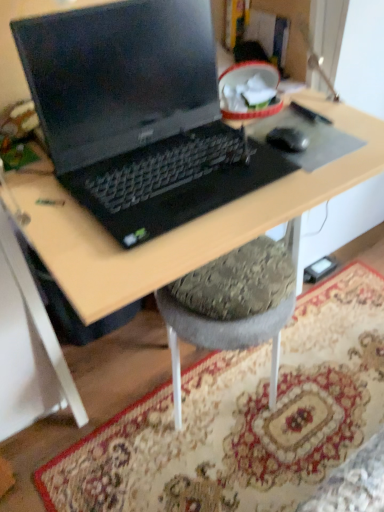
This screenshot has height=512, width=384. What do you see at coordinates (182, 226) in the screenshot?
I see `black plastic desk at center` at bounding box center [182, 226].

What do you see at coordinates (242, 419) in the screenshot?
I see `carpeted rug at lower center` at bounding box center [242, 419].

The image size is (384, 512). Identify the location of black rubber mouse at right. (287, 139).

In order to face black matte mousepad at center, should I rotate leftwards or rightwards?

Rotate right and turn 14.039 degrees.

Describe the element at coordinates (308, 138) in the screenshot. The width and height of the screenshot is (384, 512). I see `black matte mousepad at center` at that location.

Locate an element on the screen. Image resolution: width=384 pixels, height=512 pixels. black matte laptop at center is located at coordinates (139, 114).

Does black rubber mouse at right touch black matte laptop at center?

No, black rubber mouse at right is not with black matte laptop at center.

Based on the photo, from a real-world perspective, is black rubber mouse at right on black matte laptop at center?

No, from a real-world perspective, black rubber mouse at right is not above black matte laptop at center.

Is black rubber mouse at right looking in the opposite direction of black matte laptop at center?

No, black rubber mouse at right's orientation is not away from black matte laptop at center.

Who is smaller, black rubber mouse at right or black plastic desk at center?

With smaller size is black rubber mouse at right.

Is black rubber mouse at right oriented away from black plastic desk at center?

Yes, black rubber mouse at right's orientation is away from black plastic desk at center.

Considering the sizes of objects black rubber mouse at right and black plastic desk at center in the image provided, who is taller, black rubber mouse at right or black plastic desk at center?

With more height is black plastic desk at center.

Considering the relative positions of black rubber mouse at right and black plastic desk at center in the image provided, is black rubber mouse at right to the left or to the right of black plastic desk at center?

black rubber mouse at right is to the right of black plastic desk at center.

Which object is wider, carpeted rug at lower center or black matte laptop at center?

With larger width is carpeted rug at lower center.

Between carpeted rug at lower center and black matte laptop at center, which one has smaller size?

carpeted rug at lower center.

How many degrees apart are the facing directions of carpeted rug at lower center and black matte laptop at center?

They differ by 0.7 degrees in their facing directions.

Which is in front, carpeted rug at lower center or black matte laptop at center?

black matte laptop at center is in front.

Can you tell me how much black rubber mouse at right and carpeted rug at lower center differ in facing direction?

The angular difference between black rubber mouse at right and carpeted rug at lower center is 6.12 degrees.

Considering the positions of objects black rubber mouse at right and carpeted rug at lower center in the image provided, who is more to the right, black rubber mouse at right or carpeted rug at lower center?

From the viewer's perspective, carpeted rug at lower center appears more on the right side.

Identify the location of mat in front of the black rubber mouse at right. (242, 419).

Is the position of black rubber mouse at right more distant than that of carpeted rug at lower center?

Yes.

From a real-world perspective, is black plastic desk at center over black matte laptop at center?

Actually, black plastic desk at center is physically below black matte laptop at center in the real world.

In terms of width, does black plastic desk at center look wider or thinner when compared to black matte laptop at center?

Clearly, black plastic desk at center has more width compared to black matte laptop at center.

Consider the image. How different are the orientations of black plastic desk at center and black matte laptop at center in degrees?

0.7 degrees separate the facing orientations of black plastic desk at center and black matte laptop at center.

Considering the positions of objects black plastic desk at center and black matte laptop at center in the image provided, who is in front, black plastic desk at center or black matte laptop at center?

black plastic desk at center.

Which of these two, carpeted rug at lower center or black matte mousepad at center, is smaller?

With smaller size is black matte mousepad at center.

Find the location of a particular element. This screenshot has width=384, height=512. mousepad in front of the carpeted rug at lower center is located at coordinates (308, 138).

Considering the positions of point (133, 473) and point (320, 130), is point (133, 473) closer or farther from the camera than point (320, 130)?

Point (133, 473) is positioned farther from the camera compared to point (320, 130).

Consider the image. Would you consider carpeted rug at lower center to be distant from black matte mousepad at center?

No, carpeted rug at lower center is not far from black matte mousepad at center.

From the image's perspective, relative to black rubber mouse at right, is black plastic desk at center above or below?

From the image's perspective, black plastic desk at center appears below black rubber mouse at right.

Between black plastic desk at center and black rubber mouse at right, which one is positioned in front?

black plastic desk at center.

Is point (71, 260) farther from viewer compared to point (290, 135)?

No, (71, 260) is closer to viewer.

In the image, there is a black rubber mouse at right. Where is `desk below it (from a real-world perspective)`? desk below it (from a real-world perspective) is located at coordinates (182, 226).

Image resolution: width=384 pixels, height=512 pixels. Find the location of `laptop that appears above the black rubber mouse at right (from the image's perspective)`. laptop that appears above the black rubber mouse at right (from the image's perspective) is located at coordinates (139, 114).

Locate an element on the screen. This screenshot has height=512, width=384. mouse on the right of the black plastic desk at center is located at coordinates (287, 139).

From the image, which object appears to be nearer to black plastic desk at center, black rubber mouse at right or black matte mousepad at center?

black matte mousepad at center lies closer to black plastic desk at center than the other object.

Which object lies further to the anchor point black matte laptop at center, black matte mousepad at center or black rubber mouse at right?

Among the two, black rubber mouse at right is located further to black matte laptop at center.

Considering their positions, is carpeted rug at lower center positioned further to black matte laptop at center than black matte mousepad at center?

The object further to black matte laptop at center is carpeted rug at lower center.

Which object lies further to the anchor point black matte mousepad at center, carpeted rug at lower center or black matte laptop at center?

Among the two, carpeted rug at lower center is located further to black matte mousepad at center.

Based on their spatial positions, is black matte laptop at center or black plastic desk at center further from carpeted rug at lower center?

black matte laptop at center.

From the image, which object appears to be nearer to black matte laptop at center, black plastic desk at center or black rubber mouse at right?

black plastic desk at center lies closer to black matte laptop at center than the other object.

In the scene shown: Considering their positions, is black matte laptop at center positioned closer to carpeted rug at lower center than black rubber mouse at right?

Based on the image, black matte laptop at center appears to be nearer to carpeted rug at lower center.

From the image, which object appears to be farther from black matte laptop at center, black rubber mouse at right or carpeted rug at lower center?

Among the two, carpeted rug at lower center is located further to black matte laptop at center.

The width and height of the screenshot is (384, 512). Find the location of `mousepad that lies between black matte laptop at center and carpeted rug at lower center from top to bottom`. mousepad that lies between black matte laptop at center and carpeted rug at lower center from top to bottom is located at coordinates (308, 138).

Locate an element on the screen. Image resolution: width=384 pixels, height=512 pixels. mouse between black matte laptop at center and carpeted rug at lower center vertically is located at coordinates (287, 139).

At what (x,y) coordinates should I click in order to perform the action: click on mouse between black matte mousepad at center and carpeted rug at lower center in the up-down direction. Please return your answer as a coordinate pair (x, y). The height and width of the screenshot is (512, 384). Looking at the image, I should click on (287, 139).

The height and width of the screenshot is (512, 384). I want to click on desk between black rubber mouse at right and carpeted rug at lower center from top to bottom, so click(182, 226).